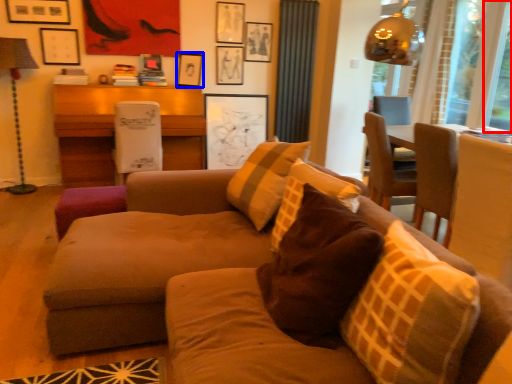
Question: Which point is further to the camera, window screen (highlighted by a red box) or picture frame (highlighted by a blue box)?

Choices:
 (A) window screen
 (B) picture frame

Answer: (B)